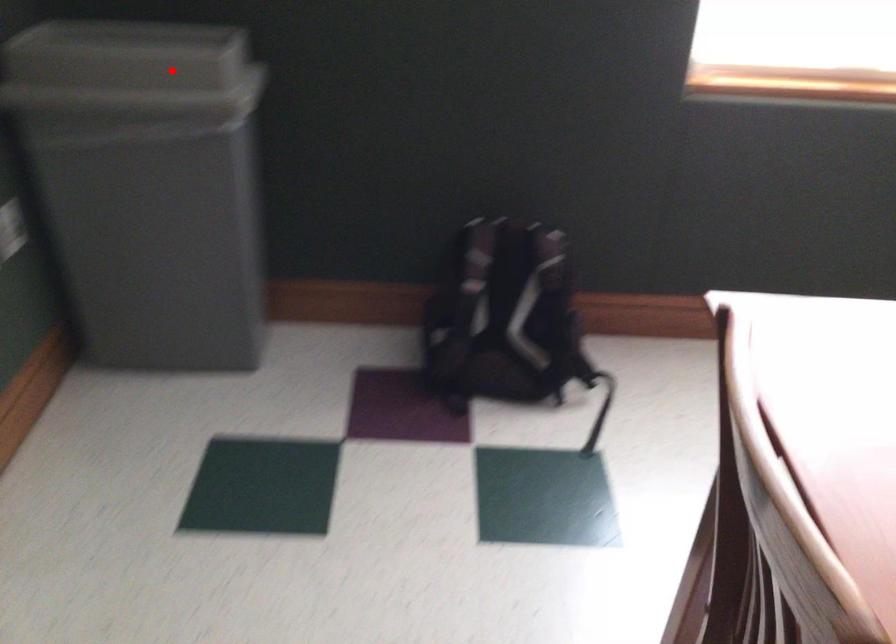
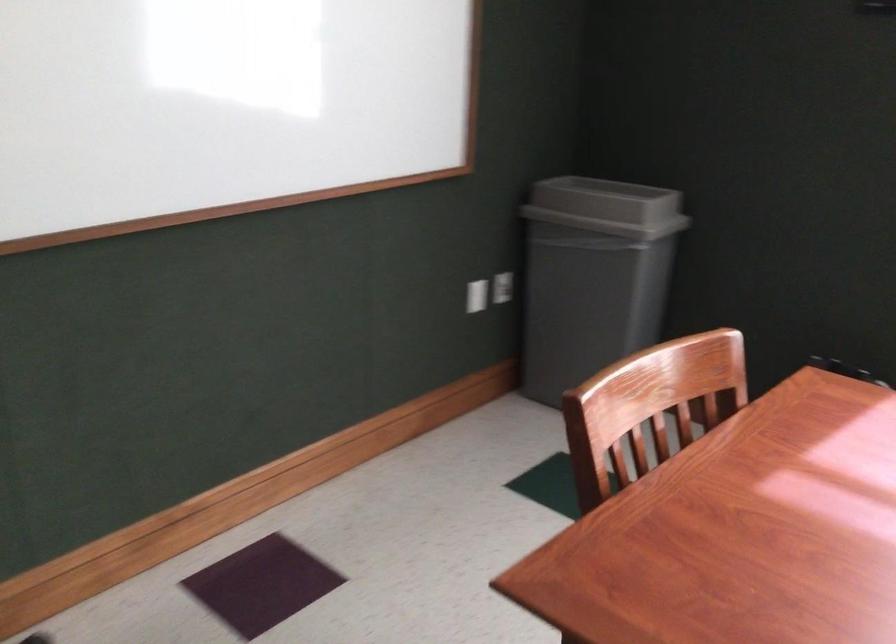
Locate, in the second image, the point that corresponds to the highlighted location in the first image.

(607, 207)